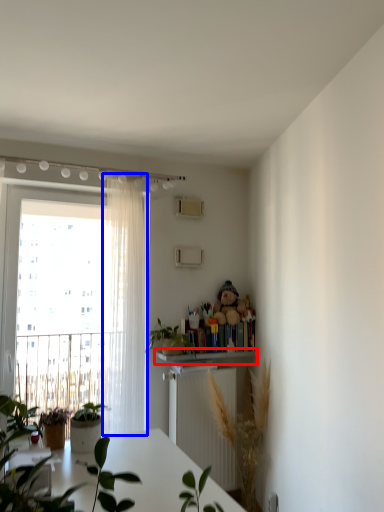
Question: Among these objects, which one is farthest to the camera, shelf (highlighted by a red box) or curtain (highlighted by a blue box)?

Choices:
 (A) shelf
 (B) curtain

Answer: (A)